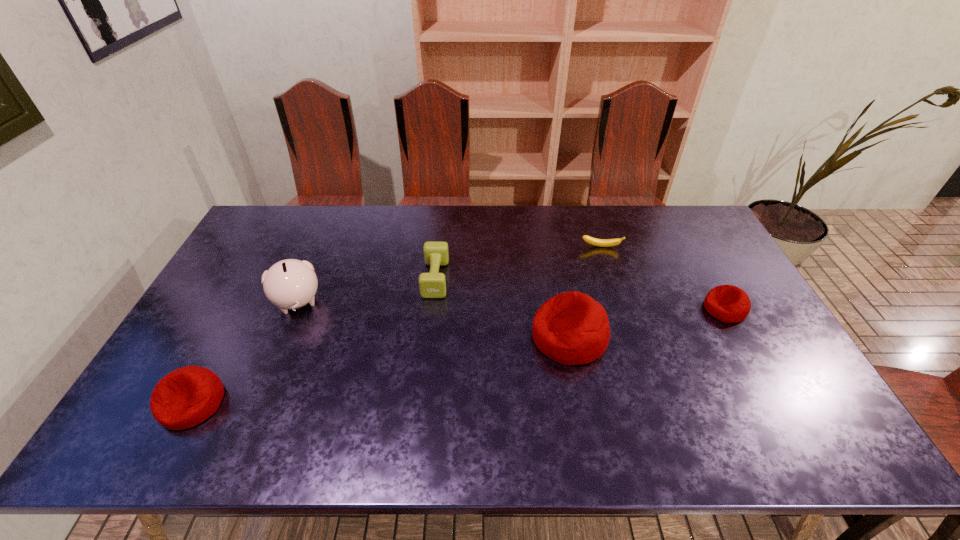
I want to click on vacant space located on the seat area of the fifth shortest object, so pyautogui.click(x=471, y=336).

This screenshot has height=540, width=960. What are the coordinates of `free space located on the seat area of the fifth shortest object` in the screenshot? It's located at (410, 336).

In order to click on free region located on the seat area of the fifth shortest object in this screenshot , I will do `click(489, 336)`.

Identify the location of free space located 0.340m on the seat area of the rightmost beanbag. (590, 309).

You are a GUI agent. You are given a task and a screenshot of the screen. Output one action in this format:
    pyautogui.click(x=<x>, y=<y>)
    Task: Click on the vacant region located on the seat area of the rightmost beanbag
    Image resolution: width=960 pixels, height=540 pixels.
    Given the screenshot: What is the action you would take?
    pyautogui.click(x=631, y=309)

Locate an element on the screen. This screenshot has height=540, width=960. blank space located on the seat area of the rightmost beanbag is located at coordinates (687, 309).

Locate an element on the screen. The width and height of the screenshot is (960, 540). free region located on the back of the piggy bank is located at coordinates (328, 227).

Where is `vacant region located 0.280m on the back of the dumbbell`? vacant region located 0.280m on the back of the dumbbell is located at coordinates (443, 211).

Find the location of a particular element. The width and height of the screenshot is (960, 540). free space located 0.220m at the stem of the banana is located at coordinates (616, 295).

Where is `object present at the far edge`? Image resolution: width=960 pixels, height=540 pixels. object present at the far edge is located at coordinates (593, 241).